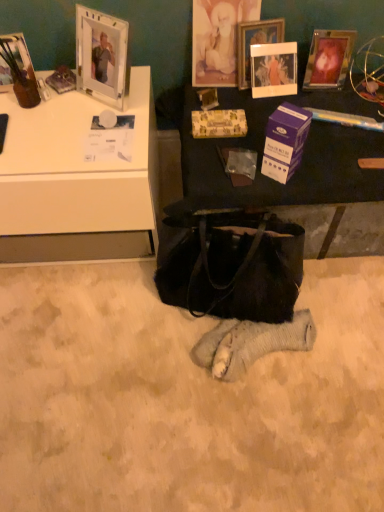
At what (x,y) coordinates should I click in order to perform the action: click on free space in front of white glossy desk at upper left. Please return your answer as a coordinate pair (x, y). Image resolution: width=384 pixels, height=512 pixels. Looking at the image, I should click on (86, 346).